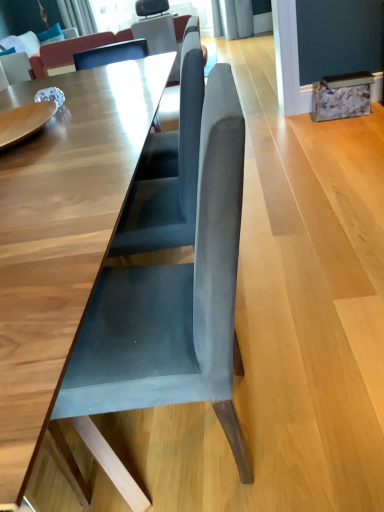
Question: Is suede couch at upper center, the second couch from the back, oriented towards velvet blue couch at upper left, which appears as the 1th couch when viewed from the back?

Choices:
 (A) no
 (B) yes

Answer: (B)

Question: Considering the relative sizes of suede couch at upper center, the second couch from the back, and velvet blue couch at upper left, marked as the 1th couch in a left-to-right arrangement, in the image provided, is suede couch at upper center, the second couch from the back, smaller than velvet blue couch at upper left, marked as the 1th couch in a left-to-right arrangement,?

Choices:
 (A) yes
 (B) no

Answer: (A)

Question: Is suede couch at upper center, the second couch from the back, far away from velvet blue couch at upper left, which appears as the 1th couch when viewed from the back?

Choices:
 (A) yes
 (B) no

Answer: (B)

Question: From the image's perspective, is suede couch at upper center, which is the 1th couch in front-to-back order, over velvet blue couch at upper left, marked as the 1th couch in a left-to-right arrangement?

Choices:
 (A) no
 (B) yes

Answer: (A)

Question: Is suede couch at upper center, which appears as the first couch when viewed from the right, closer to camera compared to velvet blue couch at upper left, arranged as the second couch when viewed from the front?

Choices:
 (A) no
 (B) yes

Answer: (B)

Question: Does suede couch at upper center, placed as the second couch when sorted from left to right, have a lesser height compared to velvet blue couch at upper left, which appears as the 1th couch when viewed from the back?

Choices:
 (A) yes
 (B) no

Answer: (B)

Question: Is suede gray chair at center aimed at velvet blue couch at upper left, arranged as the second couch when viewed from the front?

Choices:
 (A) no
 (B) yes

Answer: (A)

Question: Does suede gray chair at center have a greater width compared to velvet blue couch at upper left, marked as the 1th couch in a left-to-right arrangement?

Choices:
 (A) yes
 (B) no

Answer: (B)

Question: Can you confirm if suede gray chair at center is shorter than velvet blue couch at upper left, which appears as the 1th couch when viewed from the back?

Choices:
 (A) yes
 (B) no

Answer: (B)

Question: From the image's perspective, is suede gray chair at center located above velvet blue couch at upper left, placed as the 2th couch when sorted from right to left?

Choices:
 (A) no
 (B) yes

Answer: (A)

Question: Can you confirm if suede gray chair at center is bigger than velvet blue couch at upper left, which appears as the 1th couch when viewed from the back?

Choices:
 (A) no
 (B) yes

Answer: (A)

Question: From the image's perspective, is suede gray chair at center under velvet blue couch at upper left, placed as the 2th couch when sorted from right to left?

Choices:
 (A) yes
 (B) no

Answer: (A)

Question: Is suede couch at upper center, placed as the second couch when sorted from left to right, surrounded by velvet blue couch at upper left, marked as the 1th couch in a left-to-right arrangement?

Choices:
 (A) no
 (B) yes

Answer: (A)